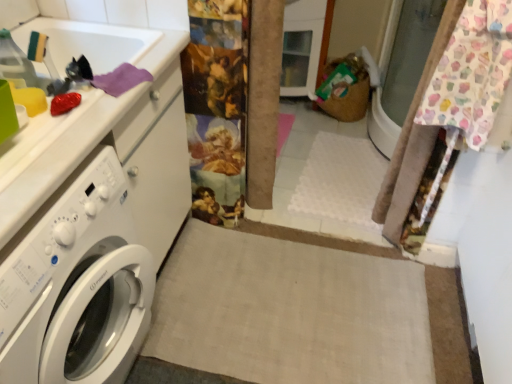
Question: Should I look upward or downward to see white glossy washing machine at left?

Choices:
 (A) up
 (B) down

Answer: (B)